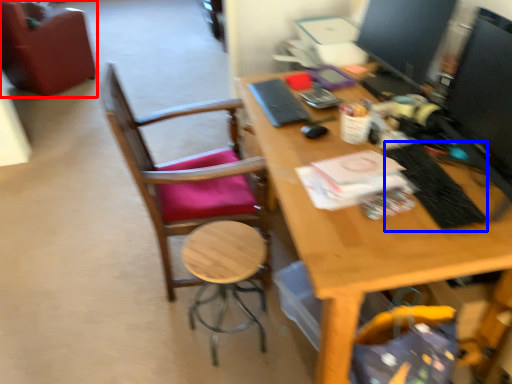
Question: Which object appears closest to the camera in this image, chair (highlighted by a red box) or laptop keyboard (highlighted by a blue box)?

Choices:
 (A) chair
 (B) laptop keyboard

Answer: (B)